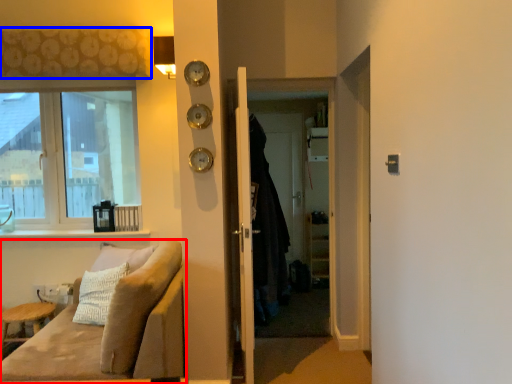
Question: Which object is closer to the camera taking this photo, studio couch (highlighted by a red box) or curtain (highlighted by a blue box)?

Choices:
 (A) studio couch
 (B) curtain

Answer: (A)